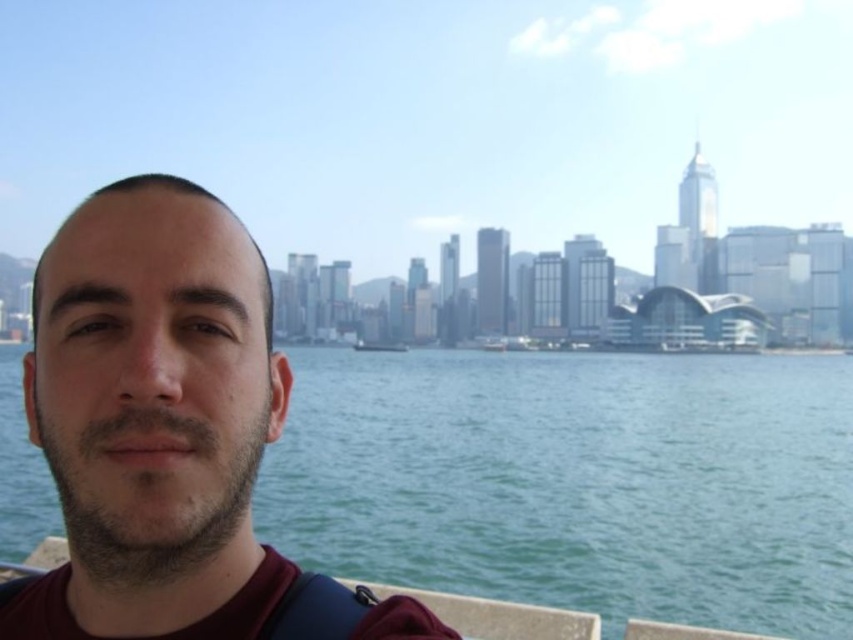
Question: Which object is closer to the camera taking this photo?

Choices:
 (A) matte black face at left
 (B) green water at center

Answer: (A)

Question: Is green water at center below matte black face at left?

Choices:
 (A) no
 (B) yes

Answer: (B)

Question: Observing the image, what is the correct spatial positioning of matte black face at left in reference to wooden sailboat at center?

Choices:
 (A) right
 (B) left

Answer: (B)

Question: Does green water at center come in front of wooden sailboat at center?

Choices:
 (A) yes
 (B) no

Answer: (A)

Question: Among these objects, which one is nearest to the camera?

Choices:
 (A) wooden sailboat at center
 (B) matte black face at left
 (C) green water at center

Answer: (B)

Question: Which object is positioned farthest from the wooden sailboat at center?

Choices:
 (A) green water at center
 (B) matte black face at left

Answer: (B)